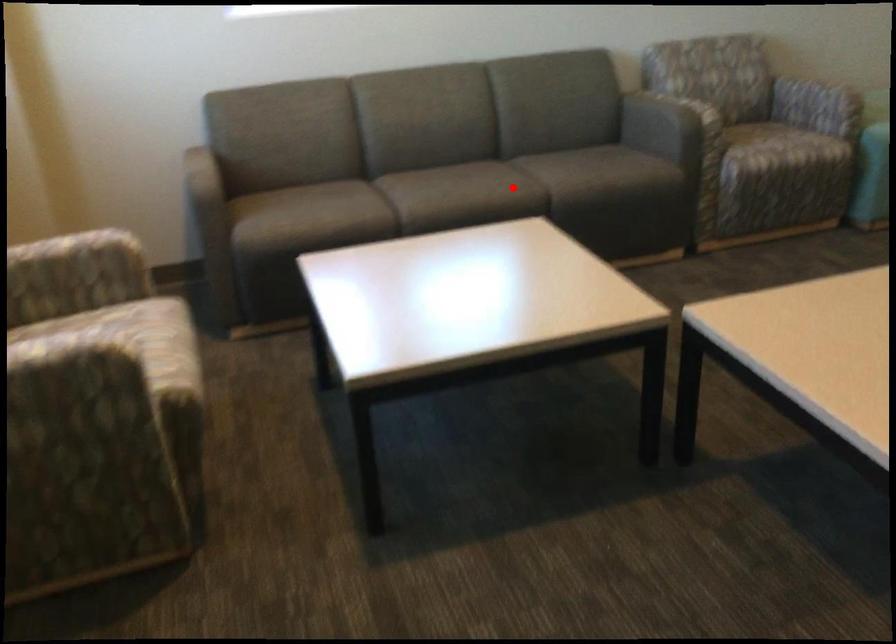
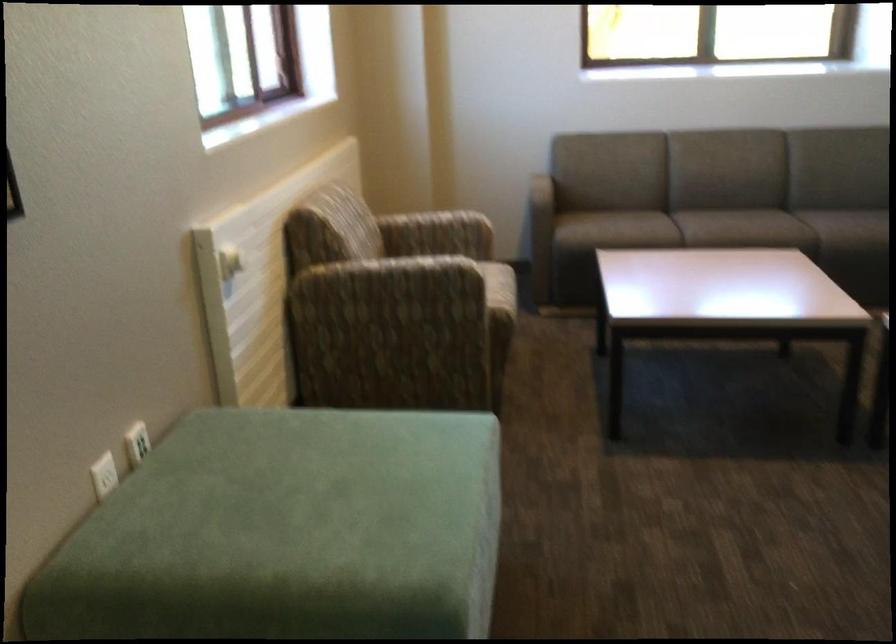
The point at the highlighted location is marked in the first image. Where is the corresponding point in the second image?

(780, 229)